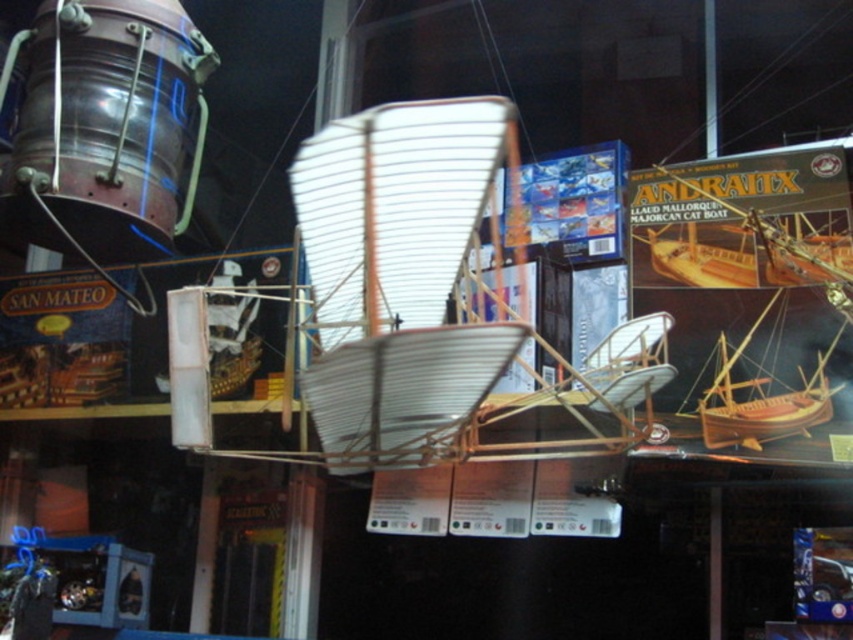
Looking at this image, you are a customer in a model shop looking to buy a boat kit. You see the metallic drum at upper left and the wooden polished boat at center. Which object is positioned higher in the display?

The metallic drum at upper left is above the wooden polished boat at center, so it is positioned higher in the display.

You are standing in front of a model boat display and want to take a closer look at the metallic drum at upper left. If your arm can reach up to 2 meters, can you touch it?

The metallic drum at upper left is 6.63 meters away from the camera, which is farther than your arm can reach. You cannot touch it with your arm.

You are a customer in the store and want to know which object is taller between the metallic drum at upper left and the wooden polished boat at center. Can you tell me?

The metallic drum at upper left is taller than the wooden polished boat at center.